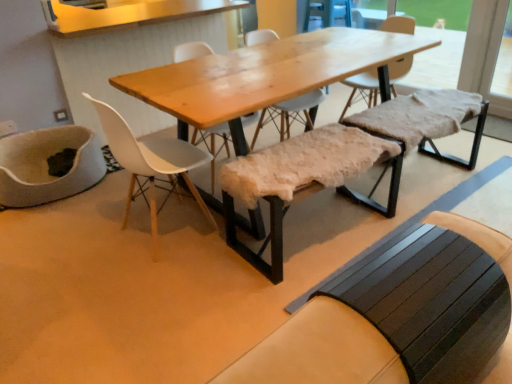
Question: Is natural wood table at center outside dark brown wooden bench at lower right, positioned as the third church bench in back-to-front order?

Choices:
 (A) yes
 (B) no

Answer: (A)

Question: From a real-world perspective, is natural wood table at center on dark brown wooden bench at lower right, the 1th church bench when ordered from front to back?

Choices:
 (A) no
 (B) yes

Answer: (A)

Question: Is natural wood table at center looking in the opposite direction of dark brown wooden bench at lower right, positioned as the third church bench in back-to-front order?

Choices:
 (A) yes
 (B) no

Answer: (B)

Question: Is natural wood table at center to the right of dark brown wooden bench at lower right, positioned as the third church bench in back-to-front order, from the viewer's perspective?

Choices:
 (A) no
 (B) yes

Answer: (A)

Question: Is natural wood table at center bigger than dark brown wooden bench at lower right, positioned as the third church bench in back-to-front order?

Choices:
 (A) yes
 (B) no

Answer: (A)

Question: Is natural wood table at center in contact with dark brown wooden bench at lower right, the 1th church bench when ordered from front to back?

Choices:
 (A) yes
 (B) no

Answer: (B)

Question: Does natural wood table at center contain wooden armchair at upper center?

Choices:
 (A) yes
 (B) no

Answer: (B)

Question: Can you confirm if natural wood table at center is positioned to the right of wooden armchair at upper center?

Choices:
 (A) no
 (B) yes

Answer: (A)

Question: Is natural wood table at center facing towards wooden armchair at upper center?

Choices:
 (A) no
 (B) yes

Answer: (A)

Question: Is natural wood table at center thinner than wooden armchair at upper center?

Choices:
 (A) no
 (B) yes

Answer: (A)

Question: Considering the relative sizes of natural wood table at center and wooden armchair at upper center in the image provided, is natural wood table at center smaller than wooden armchair at upper center?

Choices:
 (A) no
 (B) yes

Answer: (A)

Question: From the image's perspective, does natural wood table at center appear higher than wooden armchair at upper center?

Choices:
 (A) no
 (B) yes

Answer: (A)

Question: Can you confirm if fuzzy sheepskin bench at center, marked as the second church bench in a back-to-front arrangement, is positioned to the left of fuzzy sheepskin bench at center, the 1th church bench in the back-to-front sequence?

Choices:
 (A) no
 (B) yes

Answer: (B)